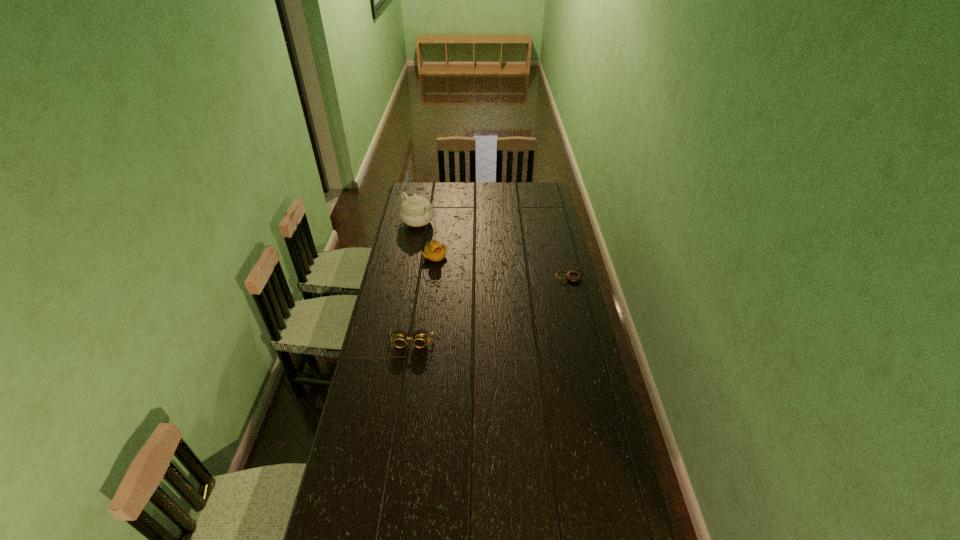
Identify the location of vacant area at the left edge of the desktop. (392, 447).

Where is `blank space at the right edge of the desktop`? blank space at the right edge of the desktop is located at coordinates (562, 266).

In the image, there is a desktop. Identify the location of vacant space at the near right corner. Image resolution: width=960 pixels, height=540 pixels. (619, 524).

Where is `free space that is in between the second tallest object and the rightmost object`? The width and height of the screenshot is (960, 540). free space that is in between the second tallest object and the rightmost object is located at coordinates coord(502,265).

Where is `free space between the duckling and the tallest object`? free space between the duckling and the tallest object is located at coordinates (426, 239).

The width and height of the screenshot is (960, 540). Find the location of `free spot between the pocket watch and the chinaware`. free spot between the pocket watch and the chinaware is located at coordinates (493, 248).

Identify the location of empty location between the farthest object and the rightmost object. The height and width of the screenshot is (540, 960). (493, 248).

Image resolution: width=960 pixels, height=540 pixels. Find the location of `empty space that is in between the shortest object and the goggles`. empty space that is in between the shortest object and the goggles is located at coordinates (491, 308).

Find the location of a particular element. vacant point located between the chinaware and the nearest object is located at coordinates (415, 282).

Locate an element on the screen. blank region between the rightmost object and the farthest object is located at coordinates (493, 248).